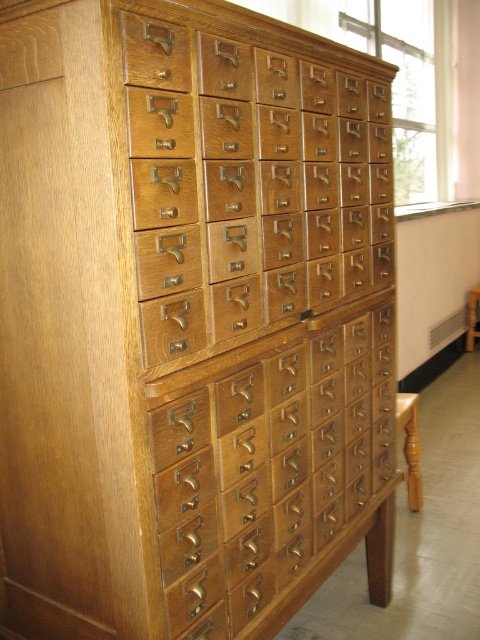
You are a librarian trying to organize some index cards. You have two drawers available for storage. The matte wood drawer at center and the light brown wood drawer at center. Which drawer has more space to store cards?

The light brown wood drawer at center has more space to store cards because it is thicker than the matte wood drawer at center.

You are a librarian who needs to locate a specific drawer in the card catalog cabinet. You see the point marked at coordinates point (251, 182). Which drawer is this point indicating?

The point (251, 182) marks the matte wood drawer at center.